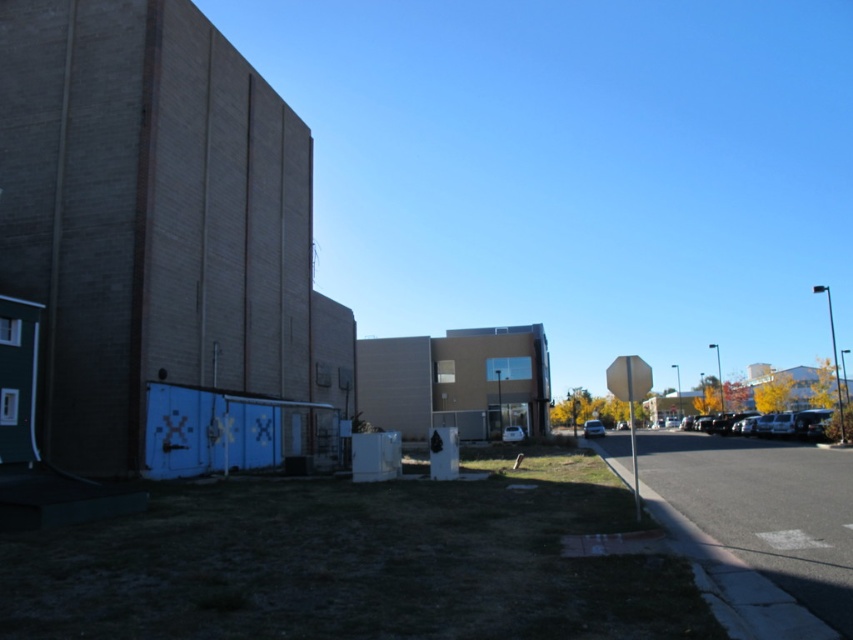
Does white matte car at center appear on the left side of shiny silver sedan at center?

Yes, white matte car at center is to the left of shiny silver sedan at center.

The height and width of the screenshot is (640, 853). Find the location of `white matte car at center`. white matte car at center is located at coordinates (512, 433).

Locate an element on the screen. Image resolution: width=853 pixels, height=640 pixels. white matte car at center is located at coordinates (512, 433).

Does metallic silver car at center have a greater height compared to white matte car at center?

Indeed, metallic silver car at center has a greater height compared to white matte car at center.

What do you see at coordinates (593, 428) in the screenshot? The image size is (853, 640). I see `metallic silver car at center` at bounding box center [593, 428].

You are a GUI agent. You are given a task and a screenshot of the screen. Output one action in this format:
    pyautogui.click(x=<x>, y=<y>)
    Task: Click on the metallic silver car at center
    This screenshot has height=640, width=853.
    Given the screenshot: What is the action you would take?
    pyautogui.click(x=593, y=428)

Between metallic silver car at center and shiny silver sedan at center, which one appears on the right side from the viewer's perspective?

Positioned to the right is shiny silver sedan at center.

Can you confirm if metallic silver car at center is positioned to the right of shiny silver sedan at center?

Incorrect, metallic silver car at center is not on the right side of shiny silver sedan at center.

Is point (598, 420) closer to camera compared to point (624, 420)?

Yes, point (598, 420) is in front of point (624, 420).

Identify the location of metallic silver car at center. The image size is (853, 640). (593, 428).